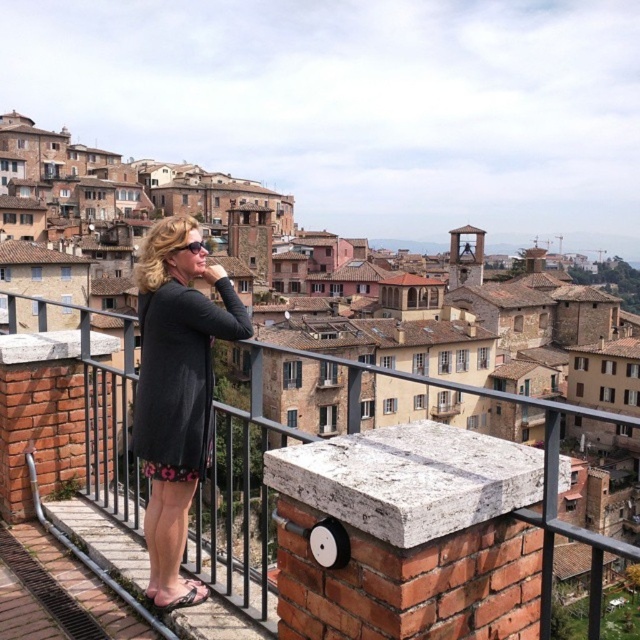
Which is behind, point (122, 474) or point (157, 458)?

The point (122, 474) is more distant.

Can you confirm if black metal/rail at upper center is thinner than floral print fabric dress at center?

In fact, black metal/rail at upper center might be wider than floral print fabric dress at center.

Is point (353, 435) positioned behind point (193, 404)?

That is False.

I want to click on black metal/rail at upper center, so click(237, 504).

Is black metal/rail at upper center to the left of dark gray dress at center from the viewer's perspective?

Incorrect, black metal/rail at upper center is not on the left side of dark gray dress at center.

Is black metal/rail at upper center taller than dark gray dress at center?

Yes.

Who is more forward, (554,536) or (144,252)?

Point (554,536) is more forward.

Find the location of `black metal/rail at upper center`. black metal/rail at upper center is located at coordinates (237, 504).

Is dark gray dress at center wider than floral print fabric dress at center?

No, dark gray dress at center is not wider than floral print fabric dress at center.

Based on the photo, which is above, dark gray dress at center or floral print fabric dress at center?

floral print fabric dress at center is above.

Locate an element on the screen. dark gray dress at center is located at coordinates (177, 390).

Find the location of a particular element. dark gray dress at center is located at coordinates (177, 390).